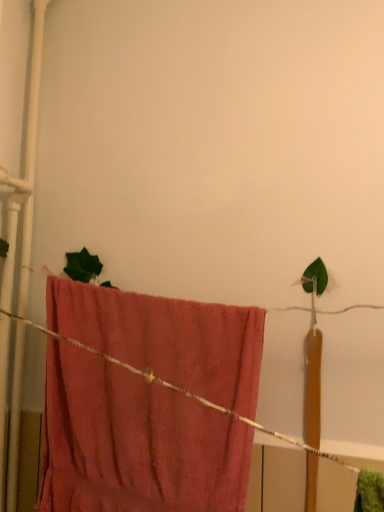
What do you see at coordinates (134, 443) in the screenshot?
I see `cotton towel at center` at bounding box center [134, 443].

Locate an element on the screen. cotton towel at center is located at coordinates (134, 443).

Where is `cotton towel at center`? cotton towel at center is located at coordinates (134, 443).